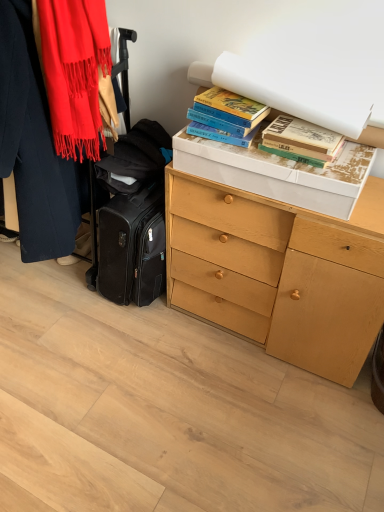
Question: Is matte red scarf at left wider than hardcover books at upper right, the 2th book in the right-to-left sequence?

Choices:
 (A) yes
 (B) no

Answer: (A)

Question: Can you confirm if matte red scarf at left is thinner than hardcover books at upper right, the 2th book in the right-to-left sequence?

Choices:
 (A) no
 (B) yes

Answer: (A)

Question: From a real-world perspective, is matte red scarf at left below hardcover books at upper right, arranged as the 1th book when viewed from the left?

Choices:
 (A) no
 (B) yes

Answer: (A)

Question: Is the position of matte red scarf at left less distant than that of hardcover books at upper right, arranged as the 1th book when viewed from the left?

Choices:
 (A) yes
 (B) no

Answer: (A)

Question: Is matte red scarf at left to the right of hardcover books at upper right, arranged as the 1th book when viewed from the left, from the viewer's perspective?

Choices:
 (A) yes
 (B) no

Answer: (B)

Question: From the image's perspective, is matte red scarf at left above or below hardcover books at upper right, the second book when ordered from left to right?

Choices:
 (A) above
 (B) below

Answer: (A)

Question: Is matte red scarf at left inside the boundaries of hardcover books at upper right, the second book when ordered from left to right, or outside?

Choices:
 (A) inside
 (B) outside

Answer: (B)

Question: Looking at their shapes, would you say matte red scarf at left is wider or thinner than hardcover books at upper right, the second book when ordered from left to right?

Choices:
 (A) wide
 (B) thin

Answer: (A)

Question: Is point (72, 18) positioned closer to the camera than point (268, 141)?

Choices:
 (A) closer
 (B) farther

Answer: (A)

Question: Considering their positions, is hardcover books at upper right, the first book viewed from the right, located in front of or behind matte red scarf at left?

Choices:
 (A) behind
 (B) front

Answer: (A)

Question: From the image's perspective, relative to matte red scarf at left, is hardcover books at upper right, the first book viewed from the right, above or below?

Choices:
 (A) below
 (B) above

Answer: (A)

Question: Considering the positions of hardcover books at upper right, the second book when ordered from left to right, and matte red scarf at left in the image, is hardcover books at upper right, the second book when ordered from left to right, taller or shorter than matte red scarf at left?

Choices:
 (A) short
 (B) tall

Answer: (A)

Question: In the image, is hardcover books at upper right, the second book when ordered from left to right, on the left side or the right side of matte red scarf at left?

Choices:
 (A) right
 (B) left

Answer: (A)

Question: Which is correct: light wood chest of drawers at center is inside matte red scarf at left, or outside of it?

Choices:
 (A) inside
 (B) outside

Answer: (B)

Question: In the image, is light wood chest of drawers at center on the left side or the right side of matte red scarf at left?

Choices:
 (A) right
 (B) left

Answer: (A)